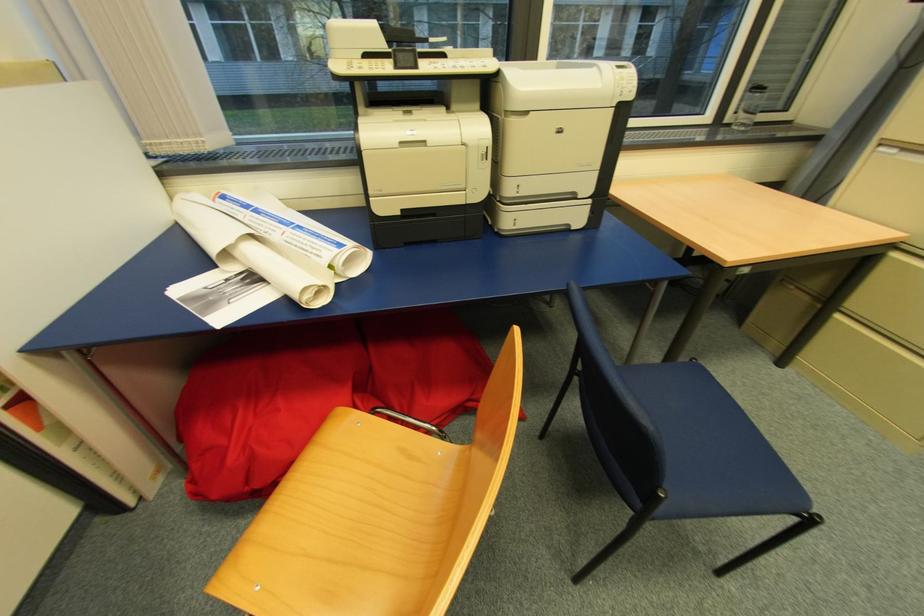
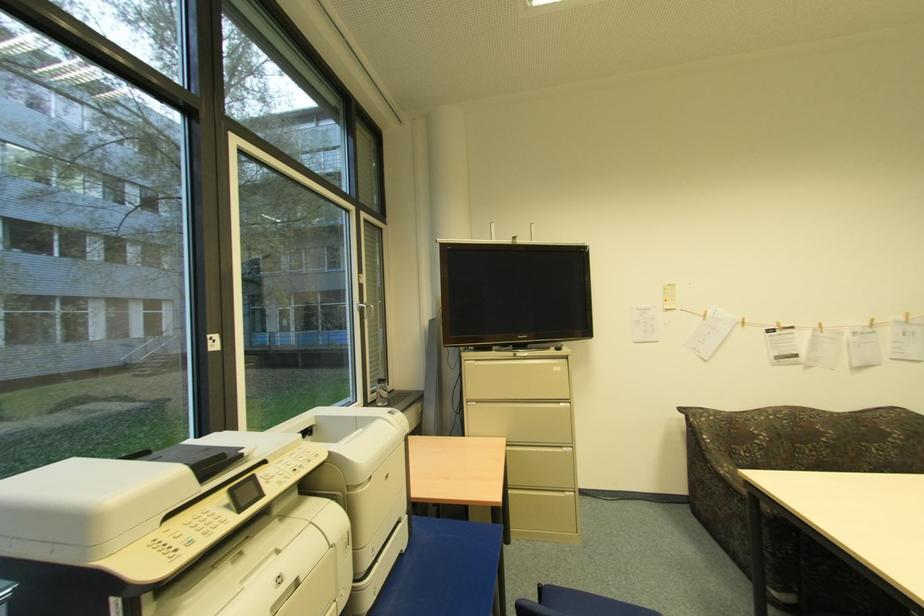
Question: Based on the continuous images, in which direction is the camera rotating? Reply with the corresponding letter.

Choices:
 (A) Left
 (B) Right
 (C) Up
 (D) Down

Answer: (B)